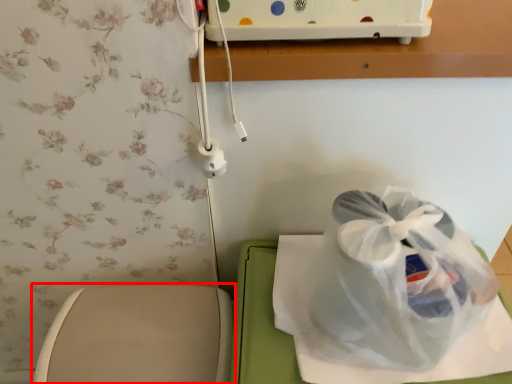
Question: Observing the image, what is the correct spatial positioning of toilet (annotated by the red box) in reference to plastic bag?

Choices:
 (A) right
 (B) left

Answer: (B)